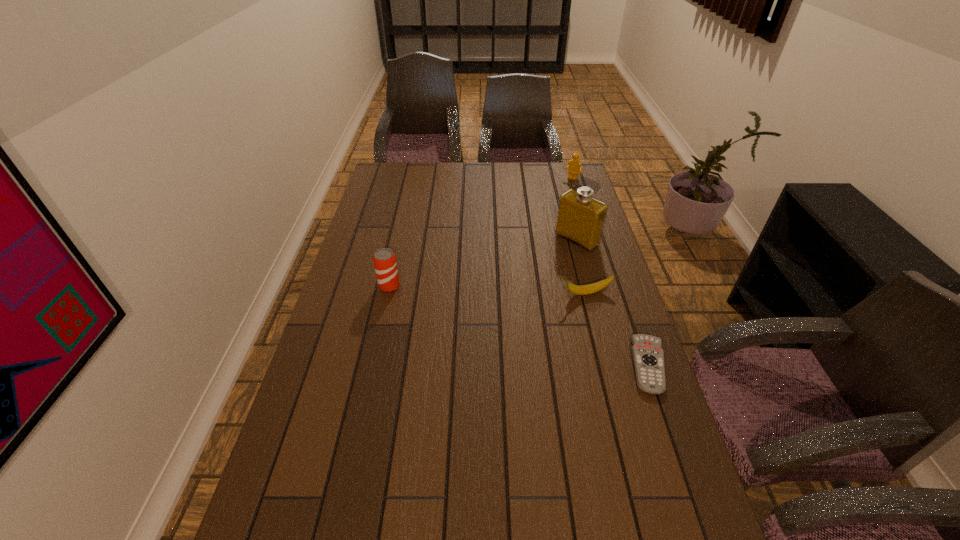
Find the location of a particular element. This screenshot has height=540, width=960. blank region between the beer can and the remote control is located at coordinates click(519, 326).

Image resolution: width=960 pixels, height=540 pixels. I want to click on vacant area between the shortest object and the leftmost object, so click(x=519, y=326).

At what (x,y) coordinates should I click in order to perform the action: click on free area in between the banana and the remote control. Please return your answer as a coordinate pair (x, y). The width and height of the screenshot is (960, 540). Looking at the image, I should click on (617, 329).

Where is `unoccupied position between the nearest object and the Lego`? The width and height of the screenshot is (960, 540). unoccupied position between the nearest object and the Lego is located at coordinates (611, 272).

At what (x,y) coordinates should I click in order to perform the action: click on vacant area that lies between the perfume and the second shortest object. Please return your answer as a coordinate pair (x, y). This screenshot has height=540, width=960. Looking at the image, I should click on (581, 266).

I want to click on empty location between the banana and the second farthest object, so click(x=581, y=266).

In order to click on vacant area that lies between the Lego and the shortest object in this screenshot , I will do `click(611, 272)`.

You are a GUI agent. You are given a task and a screenshot of the screen. Output one action in this format:
    pyautogui.click(x=<x>, y=<y>)
    Task: Click on the empty space that is in between the fourth nearest object and the leftmost object
    Image resolution: width=960 pixels, height=540 pixels.
    Given the screenshot: What is the action you would take?
    pyautogui.click(x=483, y=263)

Choose which object is the third nearest neighbor to the leftmost object. Please provide its 2D coordinates. Your answer should be formatted as a tuple, i.e. [(x, y)], where the tuple contains the x and y coordinates of a point satisfying the conditions above.

[(648, 357)]

Identify which object is located as the second nearest to the remote control. Please provide its 2D coordinates. Your answer should be formatted as a tuple, i.e. [(x, y)], where the tuple contains the x and y coordinates of a point satisfying the conditions above.

[(581, 218)]